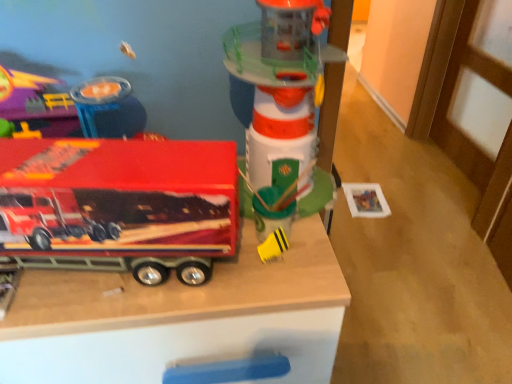
Where is `empty space that is to the right of yellow rubber duck at center, the 3th toy viewed from the left`? The width and height of the screenshot is (512, 384). empty space that is to the right of yellow rubber duck at center, the 3th toy viewed from the left is located at coordinates (319, 266).